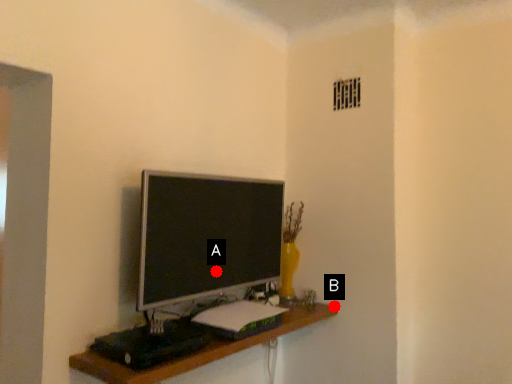
Question: Two points are circled on the image, labeled by A and B beside each circle. Which point appears closest to the camera in this image?

Choices:
 (A) A is closer
 (B) B is closer

Answer: (A)